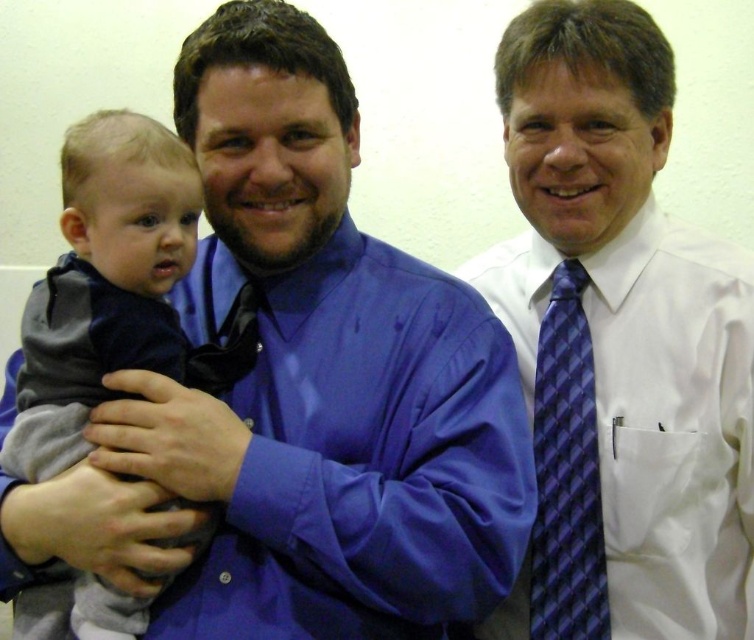
You are a photographer setting up for a group photo. You have a camera with a lens that can focus on objects within a 10 cm range. You need to ensure the white smooth shirt at center and the blue checkered tie at right are both in focus. Can the camera capture both clearly?

The distance between the white smooth shirt at center and the blue checkered tie at right is 8.36 centimeters, which is within the 10 cm focus range. Therefore, the camera can capture both clearly.

You are standing in front of the image and want to find the white smooth shirt at center. Based on the coordinates provided in the description, where would you look first?

The white smooth shirt at center is located at point (618, 346), so you should look at the center area slightly to the right and up from the bottom.

You are standing in front of the group of three people. You notice two points marked on the wall behind them. The first point is at coordinates point (x=630, y=58) and the second point is at point (x=20, y=627). Which of these two points is closer to you?

Point (x=20, y=627) is closer to you because it is in front of point (x=630, y=58).